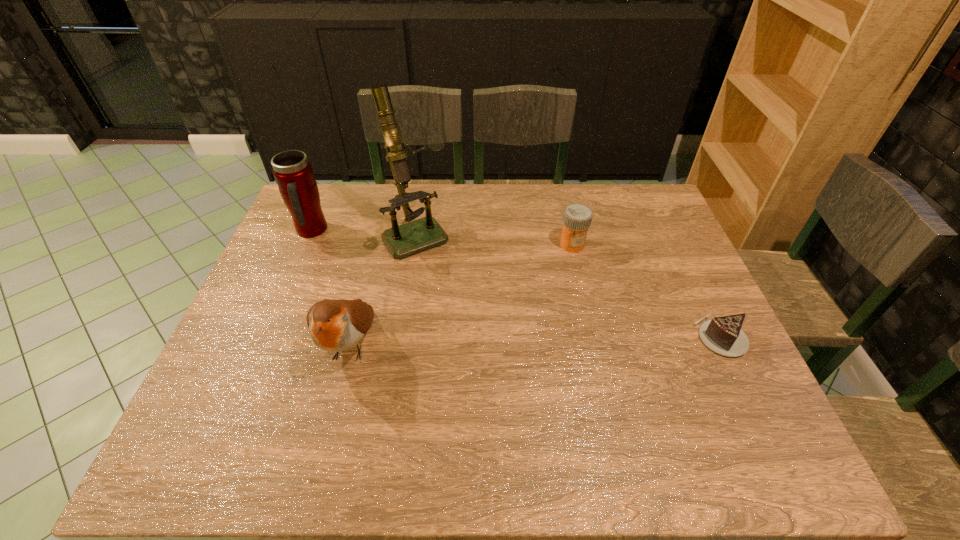
Image resolution: width=960 pixels, height=540 pixels. Find the location of `vacant region located 0.260m at the eyepiece of the microscope`. vacant region located 0.260m at the eyepiece of the microscope is located at coordinates click(x=471, y=316).

At what (x,y) coordinates should I click in order to perform the action: click on free space located 0.280m at the eyepiece of the microscope. Please return your answer as a coordinate pair (x, y). This screenshot has height=540, width=960. Looking at the image, I should click on (475, 321).

Image resolution: width=960 pixels, height=540 pixels. I want to click on vacant space located on the label side of the medicine, so click(565, 279).

Where is `vacant space located on the label side of the medicine`? The image size is (960, 540). vacant space located on the label side of the medicine is located at coordinates (552, 349).

This screenshot has width=960, height=540. Identify the location of free space located on the label side of the medicine. (567, 269).

The height and width of the screenshot is (540, 960). In order to click on free point located 0.080m on the side with the handle of the leftmost object in this screenshot , I will do `click(338, 251)`.

The width and height of the screenshot is (960, 540). In order to click on vacant region located 0.400m on the side with the handle of the leftmost object in this screenshot , I will do `click(416, 299)`.

Find the location of a particular element. This screenshot has height=540, width=960. free space located on the side with the handle of the leftmost object is located at coordinates 395,286.

Locate an element on the screen. Image resolution: width=960 pixels, height=540 pixels. microscope located in the far edge section of the desktop is located at coordinates (403, 240).

At what (x,y) coordinates should I click in order to perform the action: click on thermos bottle at the far edge. Please return your answer as a coordinate pair (x, y). This screenshot has width=960, height=540. Looking at the image, I should click on (293, 173).